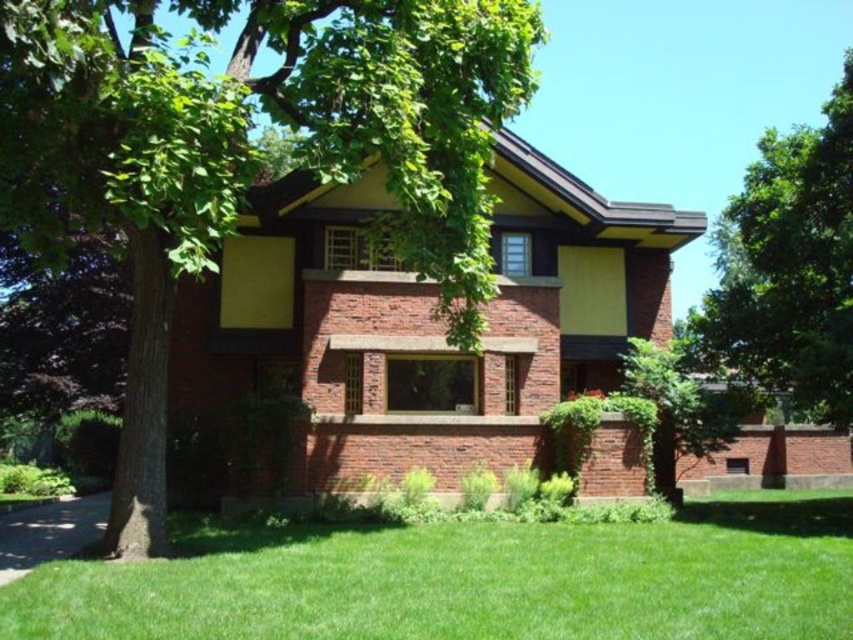
Question: Is green grass at lower center thinner than green leafy tree at lower right?

Choices:
 (A) yes
 (B) no

Answer: (B)

Question: Among these objects, which one is farthest from the camera?

Choices:
 (A) green leafy tree at upper right
 (B) green leafy tree at lower right

Answer: (B)

Question: Which of the following is the closest to the observer?

Choices:
 (A) green leafy tree at upper left
 (B) green grass at lower center

Answer: (B)

Question: Is green grass at lower center positioned behind green leafy tree at upper right?

Choices:
 (A) yes
 (B) no

Answer: (B)

Question: Which point is farther to the camera?

Choices:
 (A) green grass at lower center
 (B) green leafy tree at upper right
 (C) green leafy tree at upper left

Answer: (B)

Question: Does green leafy tree at upper left have a smaller size compared to green leafy tree at upper right?

Choices:
 (A) yes
 (B) no

Answer: (A)